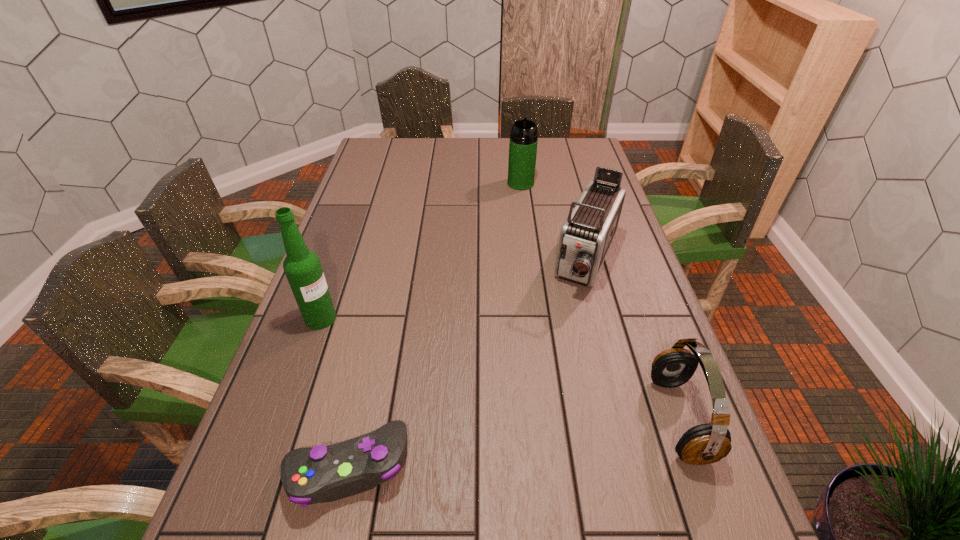
Identify the location of empty space between the shortest object and the thermos bottle. click(x=434, y=325).

Find the location of a particular element. Image resolution: width=960 pixels, height=540 pixels. free space between the tallest object and the shortest object is located at coordinates point(333,393).

Where is `free space between the fourth nearest object and the third nearest object`? The height and width of the screenshot is (540, 960). free space between the fourth nearest object and the third nearest object is located at coordinates (454, 289).

Image resolution: width=960 pixels, height=540 pixels. In order to click on free space that is in between the control and the farthest object in this screenshot , I will do `click(434, 325)`.

You are a GUI agent. You are given a task and a screenshot of the screen. Output one action in this format:
    pyautogui.click(x=<x>, y=<y>)
    Task: Click on the vacant area between the beer bottle and the shortest object
    
    Given the screenshot: What is the action you would take?
    pyautogui.click(x=333, y=393)

At what (x,y) coordinates should I click in order to perform the action: click on vacant space in between the second shortest object and the control. Please return your answer as a coordinate pair (x, y). Looking at the image, I should click on (513, 443).

Identify the location of free space between the shortest object and the third farthest object. (333, 393).

Find the location of a particular element. free space between the thermos bottle and the headset is located at coordinates (600, 301).

Where is `free space between the tallest object and the headset`? The width and height of the screenshot is (960, 540). free space between the tallest object and the headset is located at coordinates (500, 368).

Find the location of `free space between the third nearest object and the farthest object`. free space between the third nearest object and the farthest object is located at coordinates (420, 251).